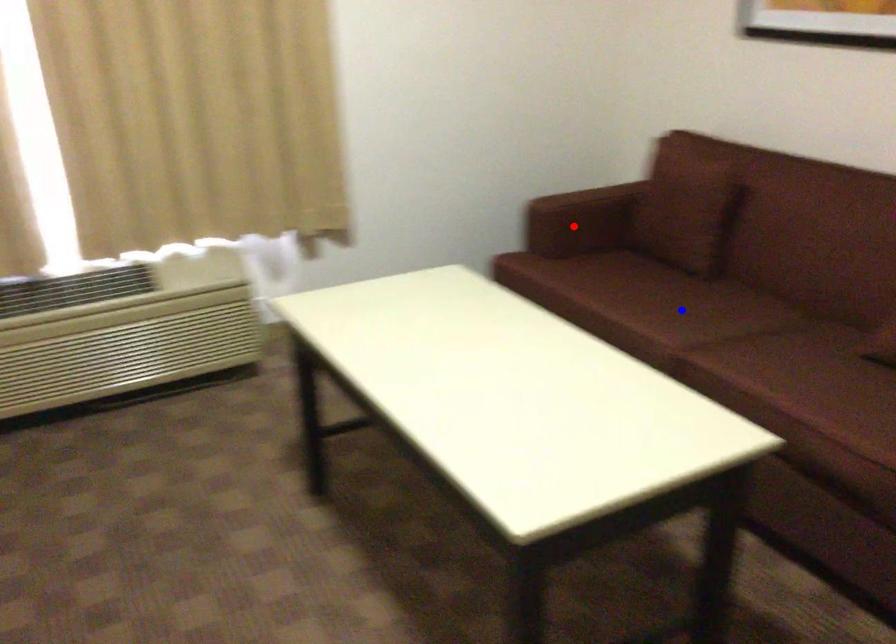
Question: In the image, two points are highlighted. Which point is nearer to the camera? Reply with the corresponding letter.

Choices:
 (A) blue point
 (B) red point

Answer: (A)